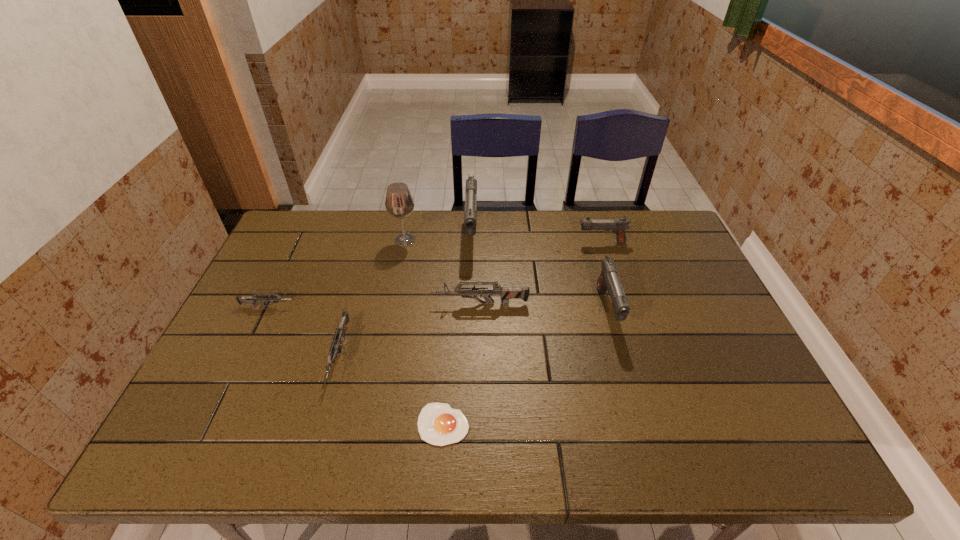
The width and height of the screenshot is (960, 540). What are the coordinates of `the second grey gun from right to left` in the screenshot? It's located at (339, 334).

This screenshot has height=540, width=960. I want to click on the shortest gun, so click(x=252, y=299).

You are a GUI agent. You are given a task and a screenshot of the screen. Output one action in this format:
    pyautogui.click(x=<x>, y=<y>)
    Task: Click on the leftmost gun
    
    Given the screenshot: What is the action you would take?
    pyautogui.click(x=252, y=299)

This screenshot has height=540, width=960. Identify the location of the nearest object. (438, 424).

The image size is (960, 540). What are the coordinates of `egg yolk` in the screenshot? It's located at (438, 424).

Image resolution: width=960 pixels, height=540 pixels. I want to click on vacant area located 0.290m on the left of the sixth object from right to left, so click(303, 240).

Where is `vacant position located 0.230m in the direction the leftmost gray gun is aimed`? The width and height of the screenshot is (960, 540). vacant position located 0.230m in the direction the leftmost gray gun is aimed is located at coordinates (469, 314).

I want to click on vacant region located in the direction the second smallest gray gun is aimed, so click(641, 430).

Where is `vacant area situated 0.350m in the direction the fourth tallest object is aimed`? vacant area situated 0.350m in the direction the fourth tallest object is aimed is located at coordinates (470, 242).

Identify the location of vacant space located in the direction the fourth tallest object is aimed. coord(483,242).